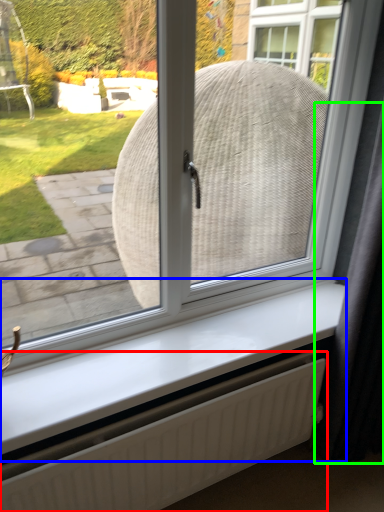
Question: Considering the real-world distances, which object is farthest from radiator (highlighted by a red box)? window sill (highlighted by a blue box) or curtain (highlighted by a green box)?

Choices:
 (A) window sill
 (B) curtain

Answer: (B)